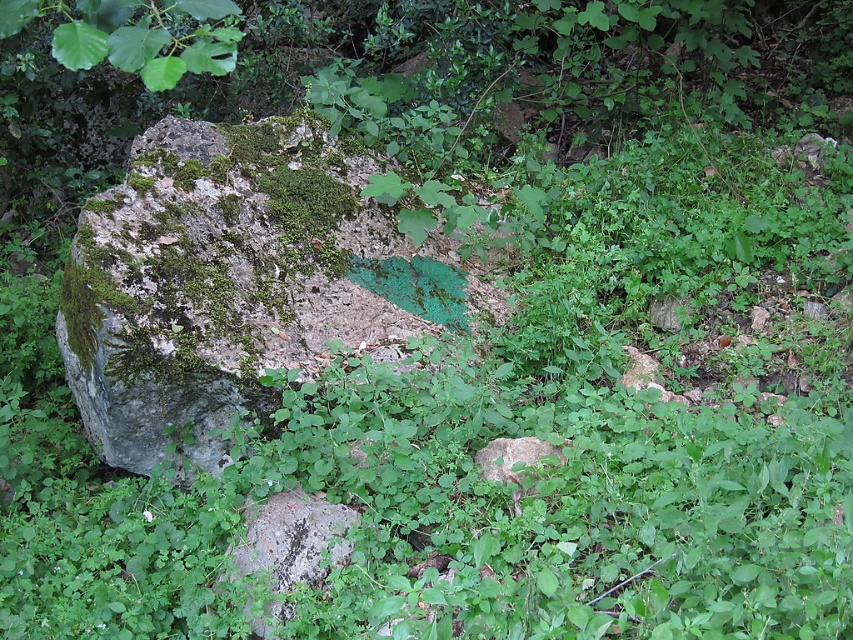
You are standing in front of the mossy rock at center and the speckled gray rock at center. Which rock is closer to you?

The mossy rock at center is closer to you because it is positioned further to the viewer than the speckled gray rock at center.